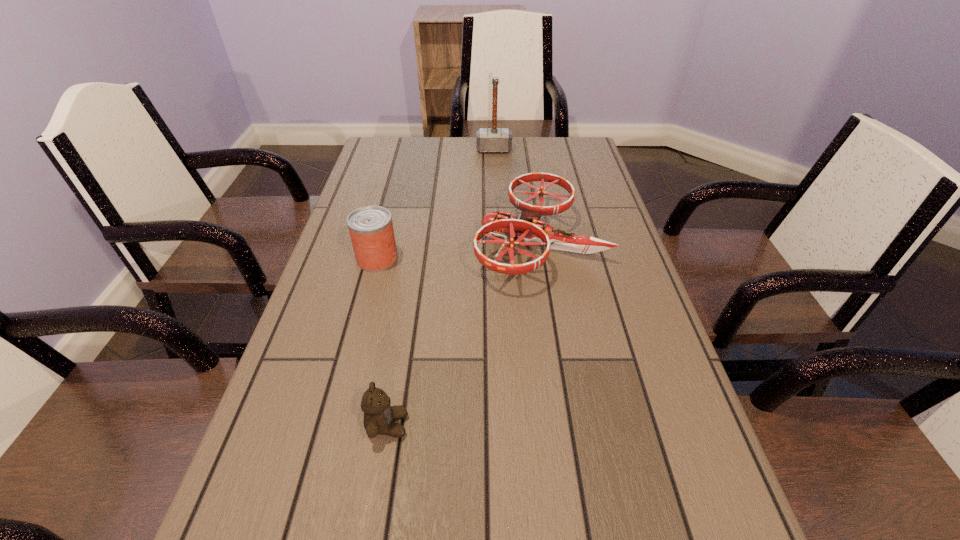
The image size is (960, 540). What are the coordinates of `the farthest object` in the screenshot? It's located at (494, 139).

Locate an element on the screen. the tallest object is located at coordinates (494, 139).

Locate an element on the screen. The image size is (960, 540). the leftmost object is located at coordinates (371, 231).

This screenshot has height=540, width=960. I want to click on can, so click(x=371, y=231).

Identify the location of the second object from left to right. The image size is (960, 540). (379, 416).

Locate an element on the screen. Image resolution: width=960 pixels, height=540 pixels. the nearest object is located at coordinates point(379,416).

At what (x,y) coordinates should I click in order to perform the action: click on drone. Please return your answer as a coordinate pair (x, y). This screenshot has height=540, width=960. Looking at the image, I should click on (529, 228).

The width and height of the screenshot is (960, 540). Identify the location of free space located 0.350m on the striking surface of the farthest object. (497, 214).

Locate an element on the screen. The width and height of the screenshot is (960, 540). blank area located on the right of the leftmost object is located at coordinates (559, 259).

The height and width of the screenshot is (540, 960). Identify the location of free region located 0.070m on the face of the nearest object. (447, 425).